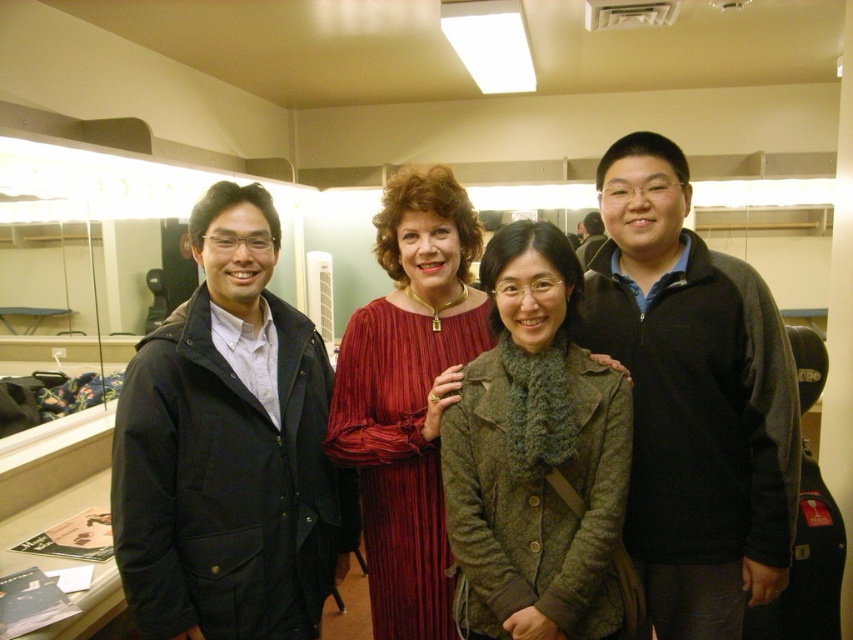
Question: Which object appears farthest from the camera in this image?

Choices:
 (A) green woolen coat at center
 (B) matte red dress at center
 (C) matte black jacket at left
 (D) matte black coat at left

Answer: (D)

Question: Among these points, which one is nearest to the camera?

Choices:
 (A) (624, 198)
 (B) (463, 376)
 (C) (590, 305)
 (D) (155, 490)

Answer: (D)

Question: Does matte black coat at left have a lesser width compared to green woolen coat at center?

Choices:
 (A) no
 (B) yes

Answer: (A)

Question: Is matte black coat at left bigger than matte red dress at center?

Choices:
 (A) no
 (B) yes

Answer: (B)

Question: Can you confirm if black fleece jacket at right is positioned to the right of green woolen coat at center?

Choices:
 (A) no
 (B) yes

Answer: (B)

Question: Which point appears closest to the camera in this image?

Choices:
 (A) (415, 579)
 (B) (697, 444)

Answer: (A)